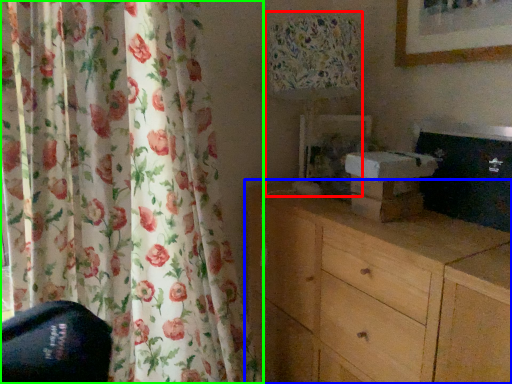
Question: Based on their relative distances, which object is farther from table lamp (highlighted by a red box)? Choose from chest of drawers (highlighted by a blue box) and curtain (highlighted by a green box).

Choices:
 (A) chest of drawers
 (B) curtain

Answer: (B)